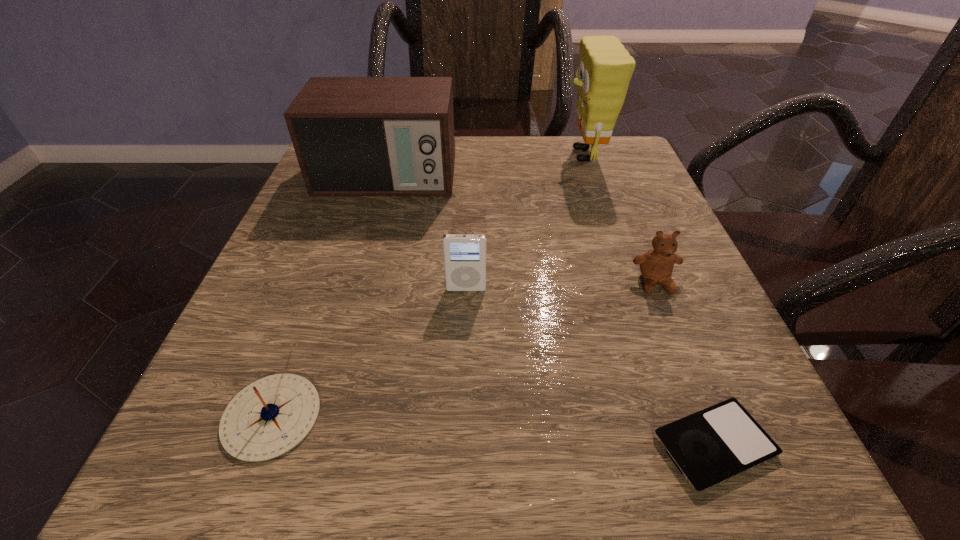
You are a GUI agent. You are given a task and a screenshot of the screen. Output one action in this format:
    pyautogui.click(x=<x>, y=<y>)
    Task: Click on the vacant area that lies between the taller iPod and the sponge
    
    Given the screenshot: What is the action you would take?
    pyautogui.click(x=525, y=222)

Find the location of a particular element. free point between the sponge and the second tallest object is located at coordinates (485, 166).

Where is `free spot between the sponge and the teddy bear`? free spot between the sponge and the teddy bear is located at coordinates point(619,219).

Where is `free spot between the nearer iPod and the third object from left to right`? This screenshot has width=960, height=540. free spot between the nearer iPod and the third object from left to right is located at coordinates (590, 367).

This screenshot has width=960, height=540. What are the coordinates of `object that is the third closest one to the teddy bear` in the screenshot? It's located at (605, 68).

Select which object appears as the second closest to the left iPod. Please provide its 2D coordinates. Your answer should be formatted as a tuple, i.e. [(x, y)], where the tuple contains the x and y coordinates of a point satisfying the conditions above.

[(656, 266)]

This screenshot has height=540, width=960. I want to click on vacant region that satisfies the following two spatial constraints: 1. on the front side of the shorter iPod; 2. on the right side of the fifth tallest object, so click(261, 445).

Where is `vacant space that satisfies the following two spatial constraints: 1. on the face of the sponge; 2. on the back side of the nearer iPod`? vacant space that satisfies the following two spatial constraints: 1. on the face of the sponge; 2. on the back side of the nearer iPod is located at coordinates (684, 445).

Locate an element on the screen. This screenshot has width=960, height=540. vacant area that satisfies the following two spatial constraints: 1. on the face of the sponge; 2. on the front-facing side of the second tallest object is located at coordinates (591, 176).

Locate an element on the screen. Image resolution: width=960 pixels, height=540 pixels. blank area in the image that satisfies the following two spatial constraints: 1. on the front-facing side of the radio receiver; 2. on the right side of the shortest object is located at coordinates (308, 445).